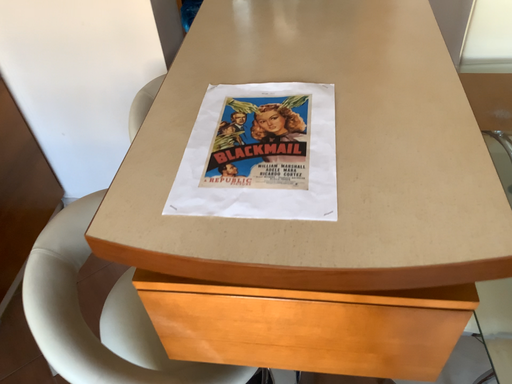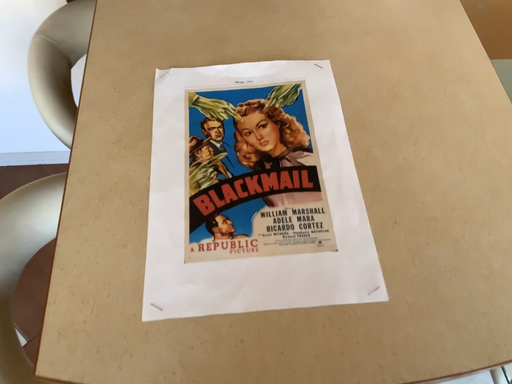
Question: Which way did the camera rotate in the video?

Choices:
 (A) rotated left
 (B) rotated right

Answer: (B)